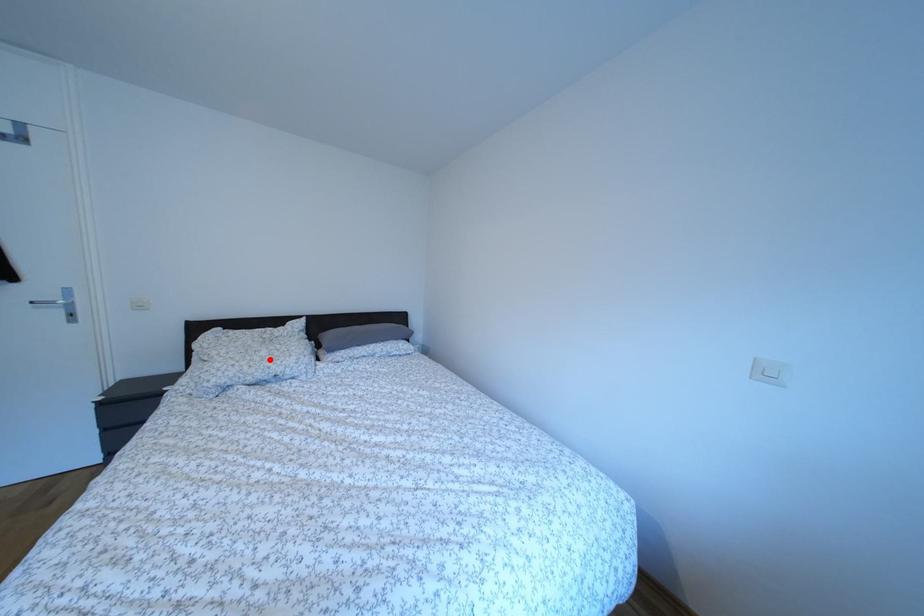
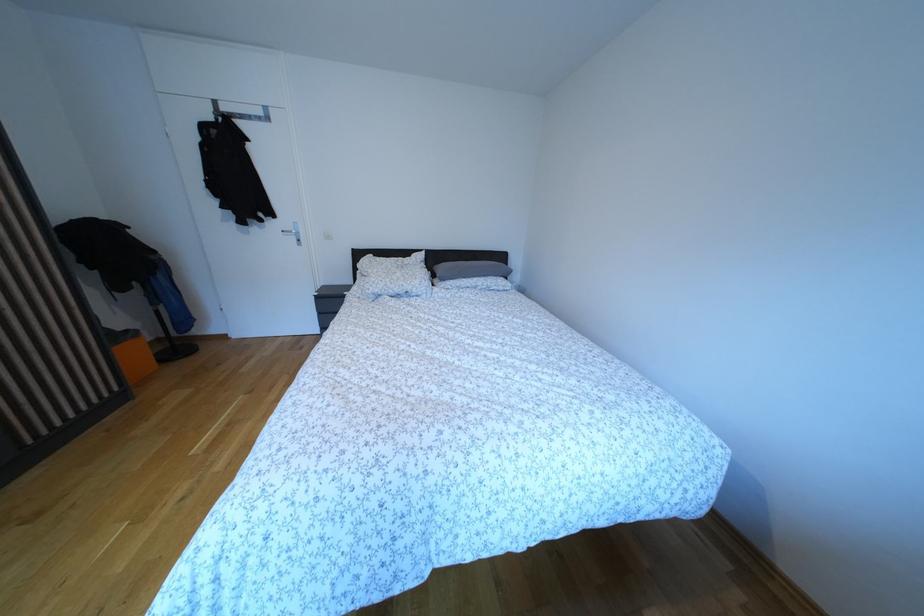
Question: A red point is marked in image1. In image2, is the corresponding 3D point closer to the camera or farther? Reply with the corresponding letter.

Choices:
 (A) The corresponding 3D point is closer.
 (B) The corresponding 3D point is farther.

Answer: (A)